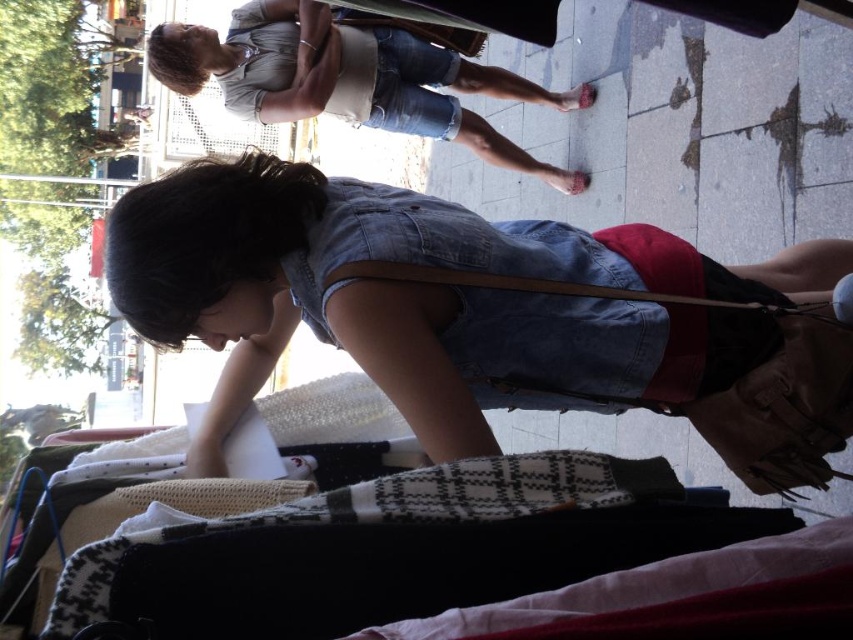
Is denim dress at center smaller than denim shorts at upper center?

Correct, denim dress at center occupies less space than denim shorts at upper center.

Is point (178, 236) positioned after point (322, 28)?

No, (178, 236) is closer to viewer.

You are a GUI agent. You are given a task and a screenshot of the screen. Output one action in this format:
    pyautogui.click(x=<x>, y=<y>)
    Task: Click on the denim dress at center
    This screenshot has width=853, height=640.
    Given the screenshot: What is the action you would take?
    pyautogui.click(x=486, y=312)